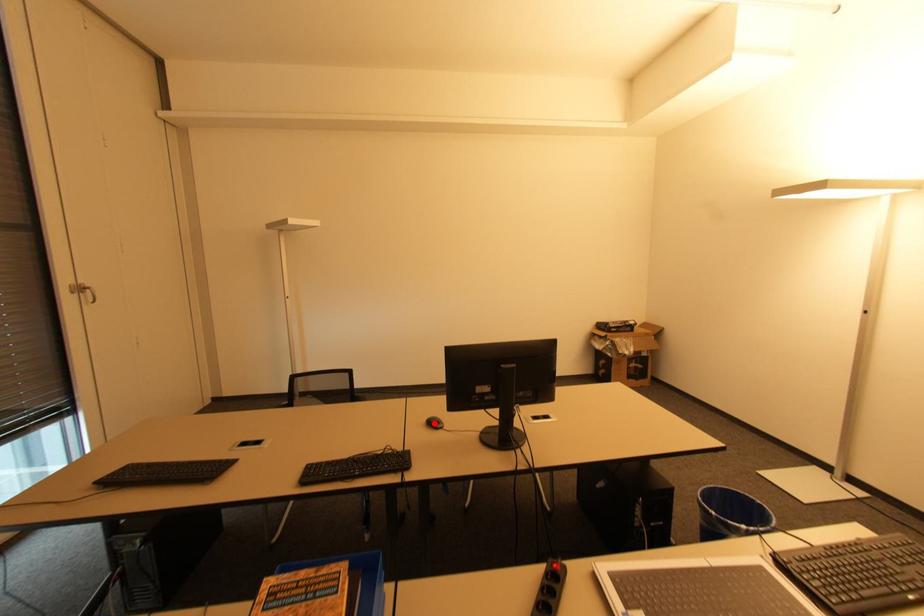
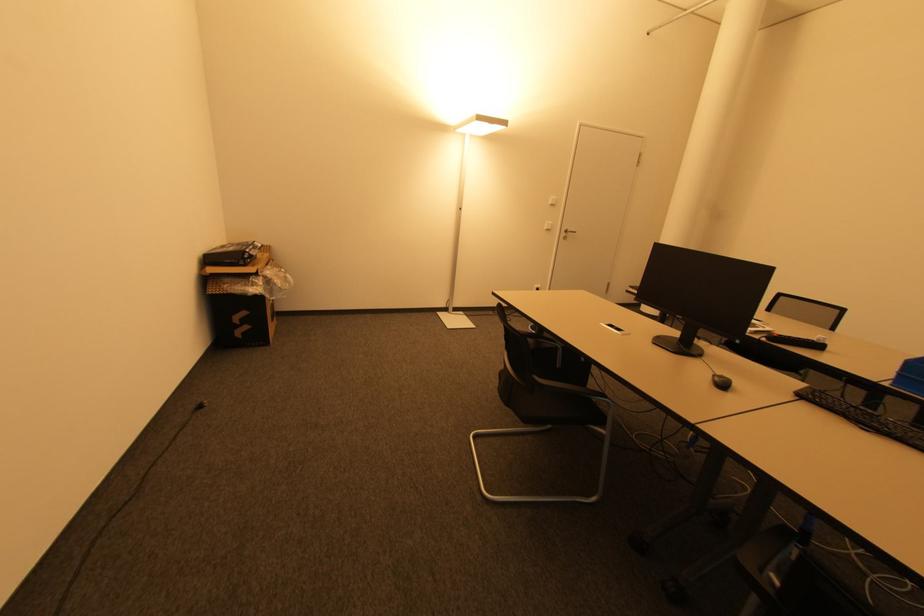
Find the pixel in the second image that matches the highlighted location in the first image.

(725, 386)